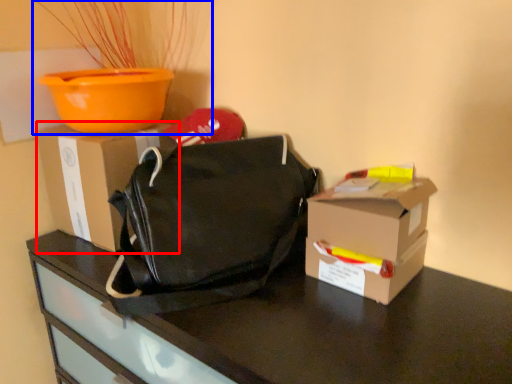
Question: Which of the following is the farthest to the observer, box (highlighted by a red box) or houseplant (highlighted by a blue box)?

Choices:
 (A) box
 (B) houseplant

Answer: (A)